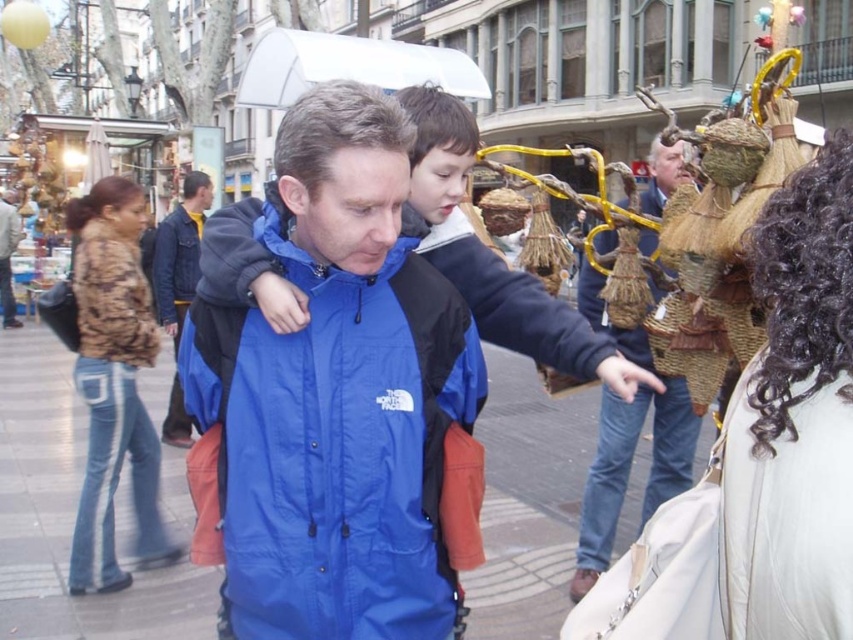
Can you confirm if camo fabric jacket at left is wider than denim jacket at left?

Yes.

The width and height of the screenshot is (853, 640). What do you see at coordinates (113, 385) in the screenshot?
I see `camo fabric jacket at left` at bounding box center [113, 385].

I want to click on camo fabric jacket at left, so click(x=113, y=385).

Is curly hair at upper right positioned before denim jacket at left?

Yes, it is.

Is point (727, 522) positioned before point (167, 237)?

Yes, point (727, 522) is closer to viewer.

The height and width of the screenshot is (640, 853). Find the location of `curly hair at upper right`. curly hair at upper right is located at coordinates (793, 419).

Is camo fabric jacket at left below blue fabric jacket at center?

Yes.

Who is positioned more to the right, camo fabric jacket at left or blue fabric jacket at center?

From the viewer's perspective, blue fabric jacket at center appears more on the right side.

Who is more forward, (96, 467) or (613, 451)?

Positioned in front is point (96, 467).

The width and height of the screenshot is (853, 640). In order to click on camo fabric jacket at left in this screenshot , I will do 113,385.